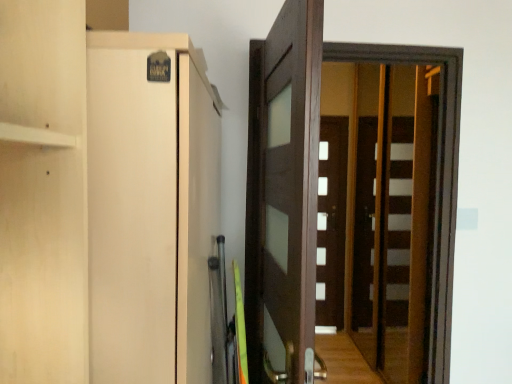
Question: Could you tell me if brown wooden screen door at center is facing matte wood cabinet at left?

Choices:
 (A) yes
 (B) no

Answer: (B)

Question: Is brown wooden screen door at center to the right of matte wood cabinet at left from the viewer's perspective?

Choices:
 (A) yes
 (B) no

Answer: (A)

Question: Can you confirm if brown wooden screen door at center is smaller than matte wood cabinet at left?

Choices:
 (A) no
 (B) yes

Answer: (B)

Question: Is matte wood cabinet at left inside brown wooden screen door at center?

Choices:
 (A) yes
 (B) no

Answer: (B)

Question: Does brown wooden screen door at center lie in front of matte wood cabinet at left?

Choices:
 (A) yes
 (B) no

Answer: (B)

Question: Can we say brown wooden screen door at center lies outside matte wood cabinet at left?

Choices:
 (A) yes
 (B) no

Answer: (A)

Question: Is brown wooden screen door at center directly adjacent to dark wood door at center, acting as the second door starting from the back?

Choices:
 (A) no
 (B) yes

Answer: (A)

Question: Is brown wooden screen door at center positioned behind dark wood door at center, arranged as the 1th door when viewed from the left?

Choices:
 (A) no
 (B) yes

Answer: (B)

Question: Is brown wooden screen door at center facing towards dark wood door at center, arranged as the 1th door when viewed from the left?

Choices:
 (A) no
 (B) yes

Answer: (A)

Question: Is brown wooden screen door at center to the right of dark wood door at center, arranged as the 1th door when viewed from the left, from the viewer's perspective?

Choices:
 (A) no
 (B) yes

Answer: (B)

Question: Is brown wooden screen door at center positioned in front of dark wood door at center, the first door from the front?

Choices:
 (A) no
 (B) yes

Answer: (A)

Question: From the image's perspective, is brown wooden screen door at center on top of dark wood door at center, the 2th door from the right?

Choices:
 (A) no
 (B) yes

Answer: (B)

Question: From a real-world perspective, is brown wooden screen door at center physically below white matte door at center, positioned as the second door in front-to-back order?

Choices:
 (A) no
 (B) yes

Answer: (A)